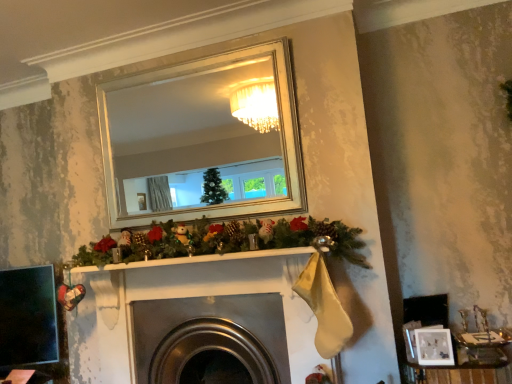
Question: Is metallic silver fireplace at center inside or outside of white matte picture frame at lower right?

Choices:
 (A) outside
 (B) inside

Answer: (A)

Question: Considering their positions, is metallic silver fireplace at center located in front of or behind white matte picture frame at lower right?

Choices:
 (A) behind
 (B) front

Answer: (A)

Question: Which of these objects is positioned closest to the metallic silver jewelry box at lower right?

Choices:
 (A) metallic silver fireplace at center
 (B) white matte picture frame at lower right

Answer: (B)

Question: Based on their relative distances, which object is farther from the white matte picture frame at lower right?

Choices:
 (A) metallic silver jewelry box at lower right
 (B) metallic silver fireplace at center

Answer: (B)